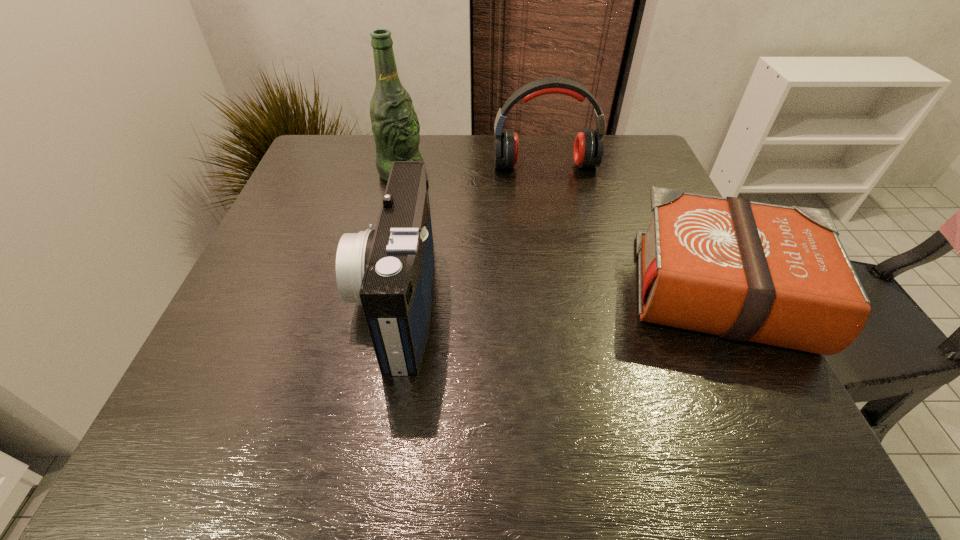
Identify the location of free point that satisfies the following two spatial constraints: 1. on the front side of the camcorder; 2. on the lens of the tallest object. The height and width of the screenshot is (540, 960). (373, 299).

Locate an element on the screen. Image resolution: width=960 pixels, height=540 pixels. vacant region that satisfies the following two spatial constraints: 1. on the front side of the beer bottle; 2. on the left side of the shortest object is located at coordinates (374, 292).

Identify the location of vacant area that satisfies the following two spatial constraints: 1. on the back side of the earphone; 2. on the right side of the beer bottle. This screenshot has width=960, height=540. pos(403,166).